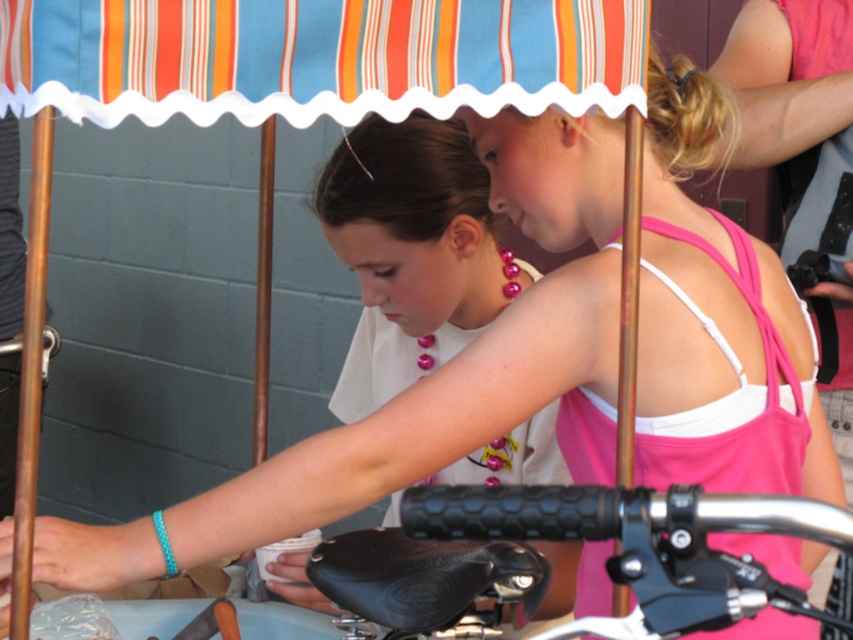
Is pink pearl necklace at upper center bigger than black rubber handlebar at center?

Yes.

Is pink pearl necklace at upper center closer to camera compared to black rubber handlebar at center?

No, pink pearl necklace at upper center is behind black rubber handlebar at center.

The image size is (853, 640). I want to click on pink pearl necklace at upper center, so click(410, 252).